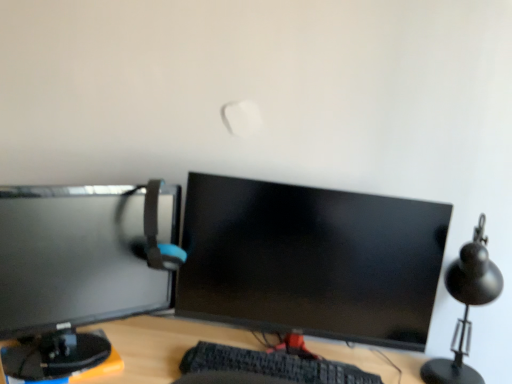
Question: Is black textured keyboard at center to the right of matte gray computer chair at left from the viewer's perspective?

Choices:
 (A) yes
 (B) no

Answer: (A)

Question: Is the position of black textured keyboard at center more distant than that of matte gray computer chair at left?

Choices:
 (A) yes
 (B) no

Answer: (B)

Question: Are black textured keyboard at center and matte gray computer chair at left far apart?

Choices:
 (A) no
 (B) yes

Answer: (A)

Question: From a real-world perspective, is black textured keyboard at center physically below matte gray computer chair at left?

Choices:
 (A) no
 (B) yes

Answer: (B)

Question: Is the position of black textured keyboard at center less distant than that of matte gray computer chair at left?

Choices:
 (A) yes
 (B) no

Answer: (A)

Question: From the image's perspective, would you say black textured keyboard at center is shown under matte gray computer chair at left?

Choices:
 (A) no
 (B) yes

Answer: (B)

Question: Is black textured keyboard at center positioned beyond the bounds of matte black monitor at center, the 2th computer monitor positioned from the left?

Choices:
 (A) yes
 (B) no

Answer: (A)

Question: Is there a large distance between black textured keyboard at center and matte black monitor at center, the 2th computer monitor positioned from the left?

Choices:
 (A) no
 (B) yes

Answer: (A)

Question: Is the position of black textured keyboard at center more distant than that of matte black monitor at center, marked as the 1th computer monitor in a right-to-left arrangement?

Choices:
 (A) no
 (B) yes

Answer: (A)

Question: Does black textured keyboard at center have a larger size compared to matte black monitor at center, marked as the 1th computer monitor in a right-to-left arrangement?

Choices:
 (A) yes
 (B) no

Answer: (B)

Question: Is black textured keyboard at center to the left of matte black monitor at center, the 2th computer monitor positioned from the left, from the viewer's perspective?

Choices:
 (A) no
 (B) yes

Answer: (B)

Question: Can you confirm if black textured keyboard at center is smaller than matte black monitor at center, the 2th computer monitor positioned from the left?

Choices:
 (A) no
 (B) yes

Answer: (B)

Question: Can you confirm if matte gray computer chair at left is bigger than matte black monitor at left, arranged as the first computer monitor when viewed from the left?

Choices:
 (A) yes
 (B) no

Answer: (B)